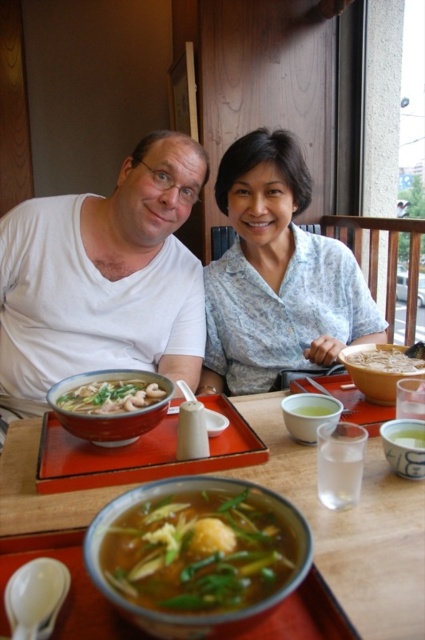
I want to click on green translucent glass at upper right, so click(408, 436).

Find the location of a particular element. Image resolution: width=425 pixels, height=640 pixels. green translucent glass at upper right is located at coordinates (408, 436).

You are a GUI agent. You are given a task and a screenshot of the screen. Output one action in this format:
    pyautogui.click(x=<x>, y=<y>)
    Task: Click on the green translucent glass at upper right
    Image resolution: width=425 pixels, height=640 pixels.
    Given the screenshot: What is the action you would take?
    pos(408,436)

Is point (317, 397) less distant than point (331, 412)?

No, it is behind (331, 412).

What do you see at coordinates (308, 413) in the screenshot?
I see `green matte bowl at center` at bounding box center [308, 413].

Locate an element on the screen. green matte bowl at center is located at coordinates (308, 413).

Is light blue cotton shirt at center shorter than white matte bowl at center?

No, light blue cotton shirt at center is not shorter than white matte bowl at center.

Does light blue cotton shirt at center appear on the right side of white matte bowl at center?

Incorrect, light blue cotton shirt at center is not on the right side of white matte bowl at center.

This screenshot has height=640, width=425. What do you see at coordinates (277, 275) in the screenshot? I see `light blue cotton shirt at center` at bounding box center [277, 275].

In order to click on light blue cotton shirt at center in this screenshot , I will do tap(277, 275).